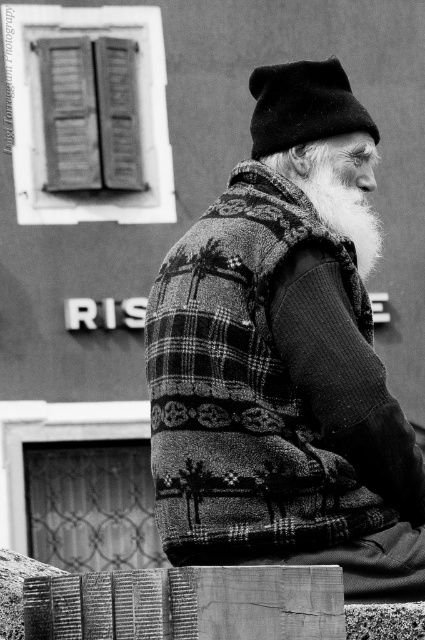
Is point (328, 115) positioned before point (329, 220)?

No, (328, 115) is further to viewer.

Can you confirm if black woolen hat at upper center is thinner than white woolen beard at upper right?

Indeed, black woolen hat at upper center has a lesser width compared to white woolen beard at upper right.

This screenshot has height=640, width=425. Find the location of `black woolen hat at upper center`. black woolen hat at upper center is located at coordinates (303, 106).

Find the location of a particular element. This screenshot has width=425, height=640. black woolen hat at upper center is located at coordinates (303, 106).

Does plaid wool vest at center have a greater width compared to black woolen hat at upper center?

Indeed, plaid wool vest at center has a greater width compared to black woolen hat at upper center.

At what (x,y) coordinates should I click in order to perform the action: click on plaid wool vest at center. Please return your answer as a coordinate pair (x, y). Looking at the image, I should click on (285, 358).

The height and width of the screenshot is (640, 425). Describe the element at coordinates (285, 358) in the screenshot. I see `plaid wool vest at center` at that location.

The width and height of the screenshot is (425, 640). Find the location of `plaid wool vest at center`. plaid wool vest at center is located at coordinates (285, 358).

Is point (357, 454) positioned in front of point (354, 193)?

Yes, it is.

Locate an element on the screen. plaid wool vest at center is located at coordinates (285, 358).